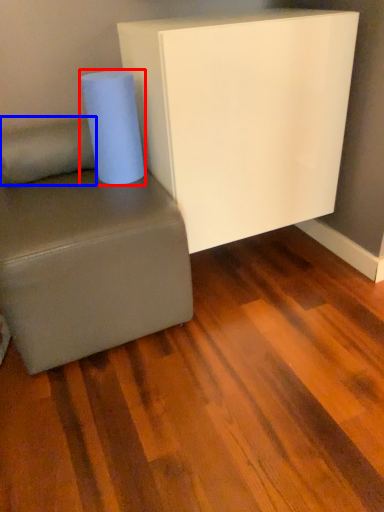
Question: Among these objects, which one is farthest to the camera, paper towel (highlighted by a red box) or pillow (highlighted by a blue box)?

Choices:
 (A) paper towel
 (B) pillow

Answer: (B)